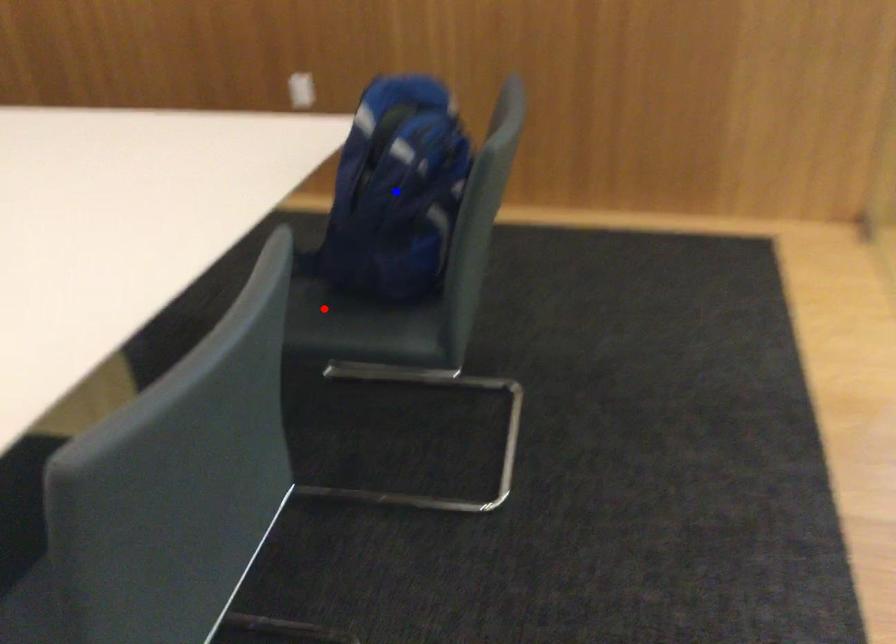
Question: Two points are marked on the image. Which point is closer to the camera?

Choices:
 (A) Blue point is closer.
 (B) Red point is closer.

Answer: (A)